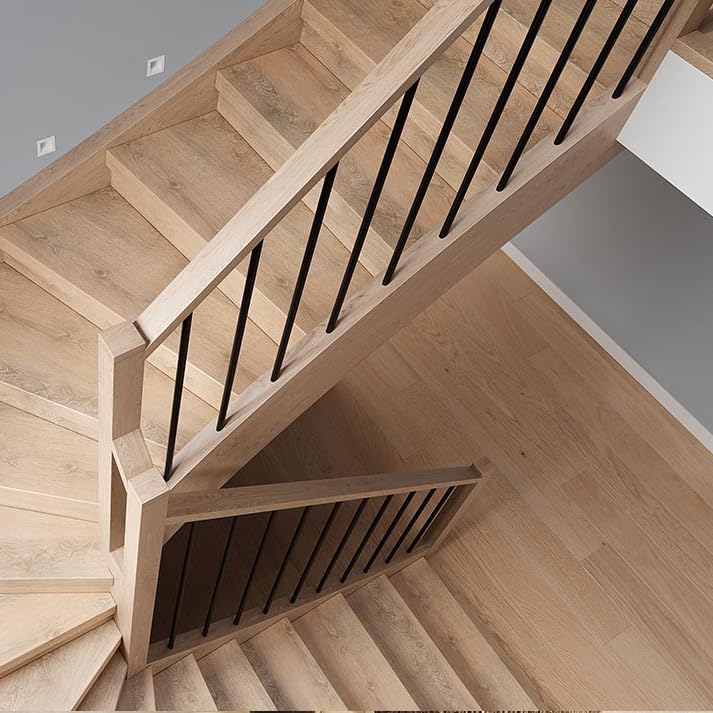
This screenshot has height=713, width=713. What are the coordinates of `top baluster` in the screenshot? It's located at (180, 381), (240, 344), (296, 292), (366, 225), (428, 165), (493, 118), (548, 81), (604, 51), (652, 31).